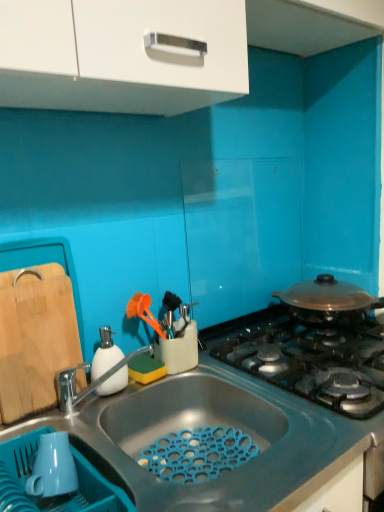
Question: Can you confirm if silver metallic tap at sink left is thinner than white glossy cabinet at upper center?

Choices:
 (A) no
 (B) yes

Answer: (B)

Question: From the image's perspective, is silver metallic tap at sink left on white glossy cabinet at upper center?

Choices:
 (A) no
 (B) yes

Answer: (A)

Question: Does silver metallic tap at sink left appear on the left side of white glossy cabinet at upper center?

Choices:
 (A) yes
 (B) no

Answer: (A)

Question: Does silver metallic tap at sink left contain white glossy cabinet at upper center?

Choices:
 (A) no
 (B) yes

Answer: (A)

Question: From the image's perspective, is silver metallic tap at sink left located beneath white glossy cabinet at upper center?

Choices:
 (A) no
 (B) yes

Answer: (B)

Question: From a real-world perspective, is silver metallic tap at sink left beneath white glossy cabinet at upper center?

Choices:
 (A) yes
 (B) no

Answer: (A)

Question: Is white matte soap dispenser at left at the left side of silver metallic tap at sink left?

Choices:
 (A) no
 (B) yes

Answer: (B)

Question: Does white matte soap dispenser at left have a greater height compared to silver metallic tap at sink left?

Choices:
 (A) no
 (B) yes

Answer: (B)

Question: Is silver metallic tap at sink left located within white matte soap dispenser at left?

Choices:
 (A) yes
 (B) no

Answer: (B)

Question: Is white matte soap dispenser at left next to silver metallic tap at sink left?

Choices:
 (A) no
 (B) yes

Answer: (B)

Question: Is white matte soap dispenser at left smaller than silver metallic tap at sink left?

Choices:
 (A) no
 (B) yes

Answer: (B)

Question: Is white matte soap dispenser at left not within silver metallic tap at sink left?

Choices:
 (A) yes
 (B) no

Answer: (A)

Question: Is natural wood cutting board at left at the left side of blue matte sink at lower center?

Choices:
 (A) yes
 (B) no

Answer: (A)